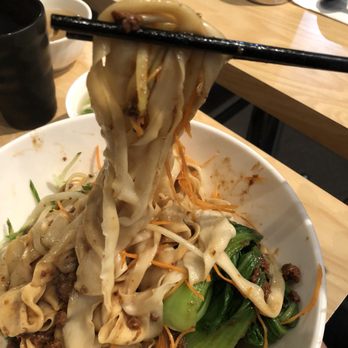
Where is `dishes`? This screenshot has height=348, width=348. dishes is located at coordinates (72, 50), (33, 70), (75, 96), (76, 135).